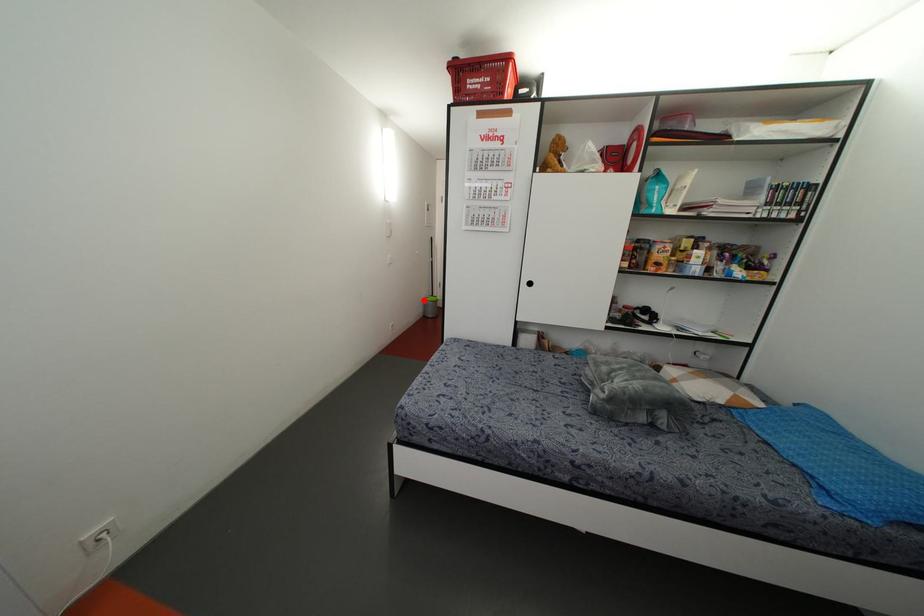
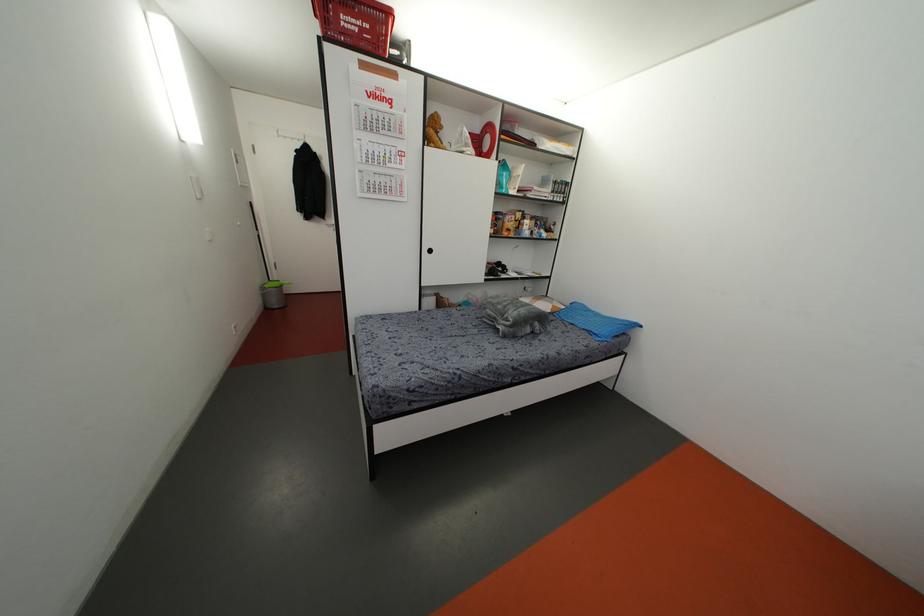
Question: I am providing you with two images of the same scene from different viewpoints. Given a red point in image1, look at the same physical point in image2. Is it:

Choices:
 (A) Closer to the viewpoint
 (B) Farther from the viewpoint

Answer: (A)